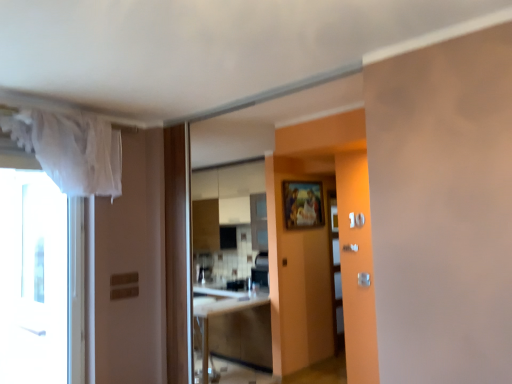
Question: From the image's perspective, is white sheer curtain at upper left above or below wooden painted frame at center?

Choices:
 (A) above
 (B) below

Answer: (A)

Question: Considering the positions of white sheer curtain at upper left and wooden painted frame at center in the image, is white sheer curtain at upper left bigger or smaller than wooden painted frame at center?

Choices:
 (A) small
 (B) big

Answer: (B)

Question: Which of these objects is positioned farthest from the wooden painted frame at center?

Choices:
 (A) white glass window at left
 (B) satin silver door handle at center right, which ranks as the 1th door handle in right-to-left order
 (C) white sheer curtain at upper left
 (D) wooden cabinet at center
 (E) silver metallic door handle at center-right, which ranks as the 1th door handle in left-to-right order

Answer: (A)

Question: Which object is the farthest from the silver metallic door handle at center-right, placed as the second door handle when sorted from front to back?

Choices:
 (A) wooden cabinet at center
 (B) white sheer curtain at upper left
 (C) satin silver door handle at center right, which ranks as the 1th door handle in right-to-left order
 (D) white glass window at left
 (E) wooden painted frame at center

Answer: (D)